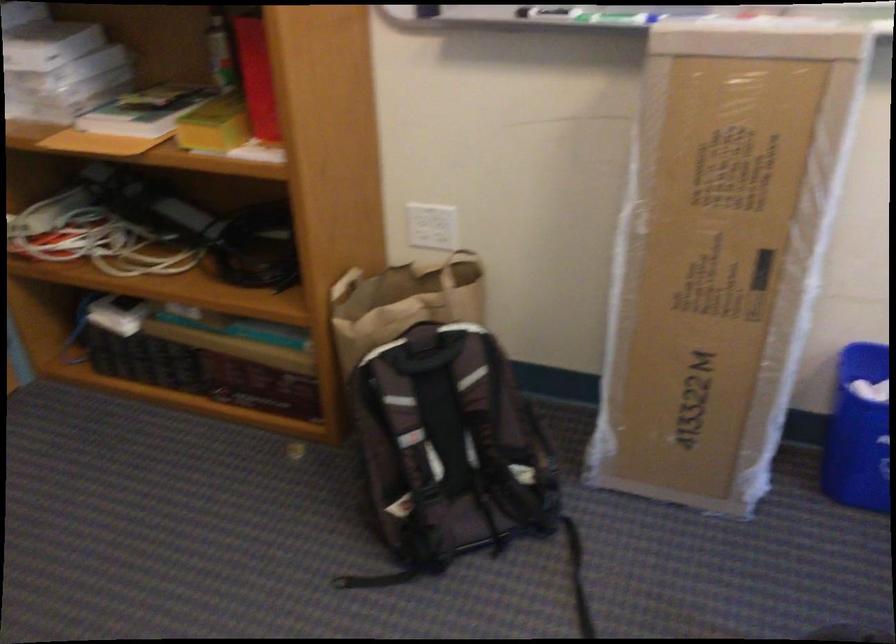
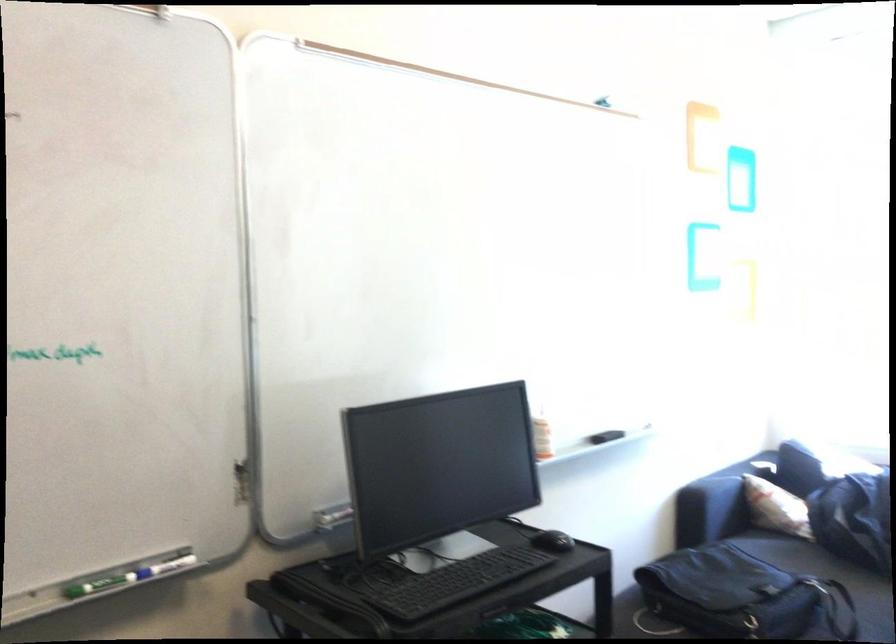
Question: The camera is either moving clockwise (left) or counter-clockwise (right) around the object. The first image is from the beginning of the video and the second image is from the end. Is the camera moving left or right when shooting the video?

Choices:
 (A) Left
 (B) Right

Answer: (A)